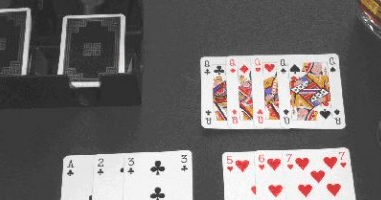
The width and height of the screenshot is (381, 200). Find the location of `card holder`. card holder is located at coordinates 50,83.